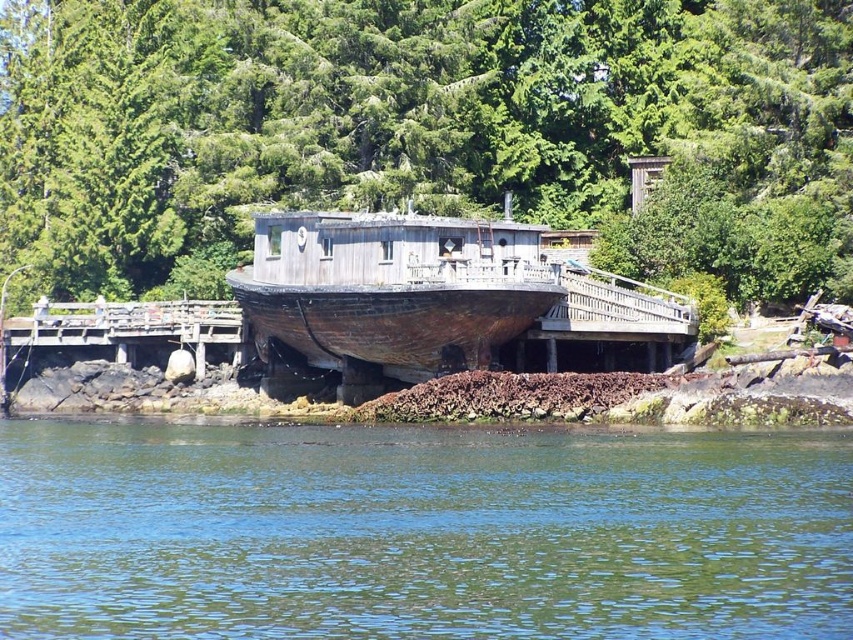
Question: Can you confirm if green textured tree at upper center is positioned below weathered wood boat at center?

Choices:
 (A) yes
 (B) no

Answer: (B)

Question: Estimate the real-world distances between objects in this image. Which object is closer to the green water at lower center?

Choices:
 (A) green textured tree at upper center
 (B) weathered wood boat at center

Answer: (B)

Question: Does green textured tree at upper center appear over weathered wood boat at center?

Choices:
 (A) yes
 (B) no

Answer: (A)

Question: Based on their relative distances, which object is farther from the green textured tree at upper center?

Choices:
 (A) green water at lower center
 (B) weathered wood boat at center

Answer: (A)

Question: Estimate the real-world distances between objects in this image. Which object is farther from the green textured tree at upper center?

Choices:
 (A) green water at lower center
 (B) weathered wood boat at center

Answer: (A)

Question: Does green textured tree at upper center lie in front of green water at lower center?

Choices:
 (A) yes
 (B) no

Answer: (B)